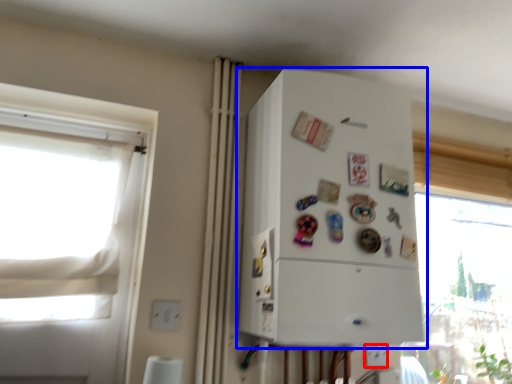
Question: Which of the following is the farthest to the observer, electric outlet (highlighted by a red box) or refrigerator (highlighted by a blue box)?

Choices:
 (A) electric outlet
 (B) refrigerator

Answer: (A)